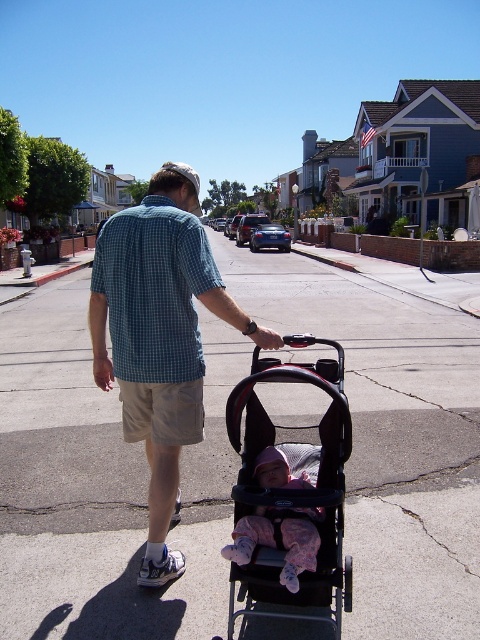
You are standing on the residential street and see the blue checkered shirt at center. Where exactly is it located in terms of coordinates?

The blue checkered shirt at center is located at coordinates point (159, 337).

You are standing on the residential street and want to walk from point A to point B. Point A is at coordinate point (377,378) and point B is at coordinate point (109,257). Which point is closer to you, point A or point B?

Point A is closer to you because it is further to the viewer than point B.